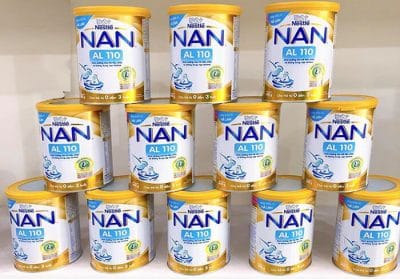
Identify the location of surface. This screenshot has width=400, height=279. (155, 270).